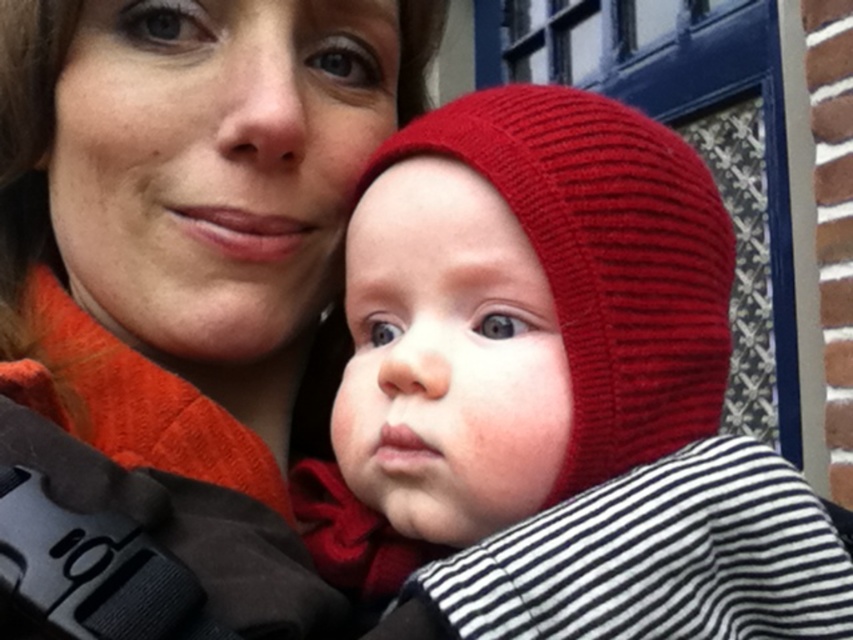
You are a photographer trying to capture a close shot of the matte orange sweater at upper left and the knitted red hat at center. The camera can only focus on objects within a 4.5 inch distance. Will the two items be in focus?

The matte orange sweater at upper left and knitted red hat at center are 4.47 inches apart from each other, so yes, the two items will be in focus since they are within the 4.5 inch distance.

You are a photographer trying to capture a close up of the baby in the image. The camera is positioned such that the focus point is at point (247, 289). Given that the minimum focus distance for your lens is 22 inches, will the baby be in focus?

The point (247, 289) is 22.26 inches from the camera, which is just beyond the minimum focus distance of 22 inches. Therefore, the baby may not be in focus and could appear slightly blurry.

You are an artist trying to sketch this scene. You need to place the matte orange sweater at upper left in your drawing. Where exactly should you position it on the canvas? Please provide coordinates as a point in the format of a tuple with two decimal numbers between 0 and 1, where the first number is the x coordinate and the second is the y coordinate. The origin is at the bottom left corner of the canvas.

The matte orange sweater at upper left should be positioned at coordinates approximately at point (177,298).